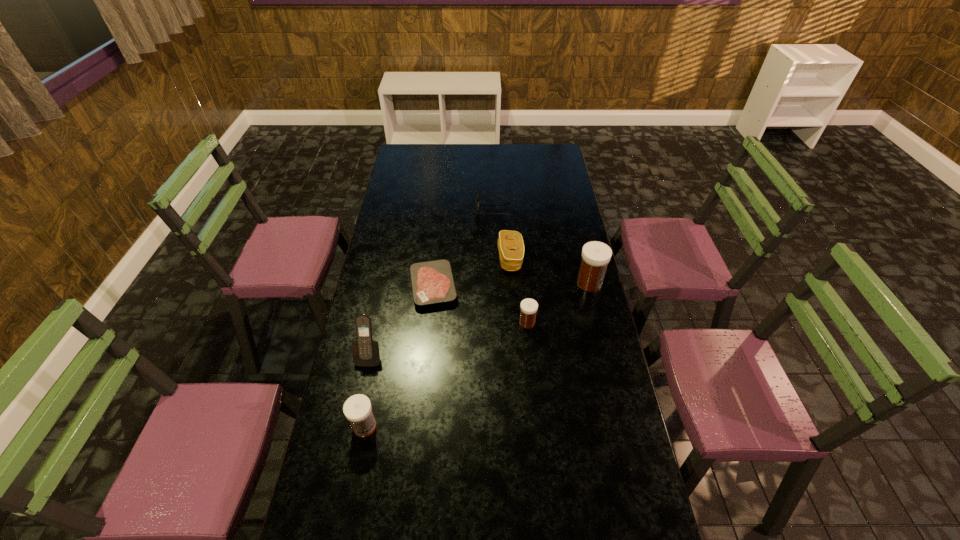
The image size is (960, 540). What are the coordinates of `free region located on the zipper side of the clutch bag` in the screenshot? It's located at (436, 259).

Where is `vacant space located on the zipper side of the clutch bag`? The width and height of the screenshot is (960, 540). vacant space located on the zipper side of the clutch bag is located at coordinates (483, 259).

Where is `vacant space located 0.170m on the front-facing side of the cellular telephone`? The height and width of the screenshot is (540, 960). vacant space located 0.170m on the front-facing side of the cellular telephone is located at coordinates (357, 414).

Locate an element on the screen. medicine located at the left edge is located at coordinates (357, 409).

You are a GUI agent. You are given a task and a screenshot of the screen. Output one action in this format:
    pyautogui.click(x=<x>, y=<y>)
    Task: Click on the cellular telephone present at the left edge
    The image size is (960, 540).
    Given the screenshot: What is the action you would take?
    pyautogui.click(x=366, y=353)

This screenshot has width=960, height=540. I want to click on object at the right edge, so click(596, 255).

Where is `vacant space at the far edge of the desktop`? vacant space at the far edge of the desktop is located at coordinates (521, 151).

Find the location of a particular element. free spot at the near edge of the desktop is located at coordinates (585, 516).

In the image, there is a desktop. Where is `vacant space at the left edge`? The width and height of the screenshot is (960, 540). vacant space at the left edge is located at coordinates (386, 305).

Locate an element on the screen. blank area at the right edge is located at coordinates 573,232.